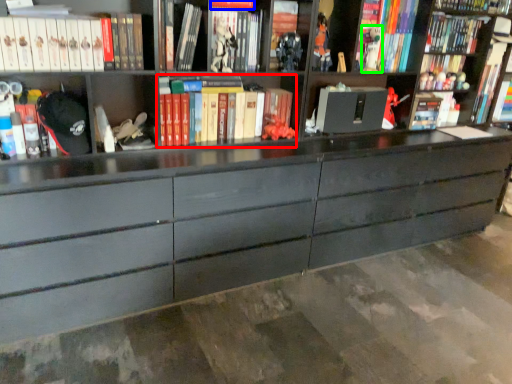
Question: Which is nearer to the book (highlighted by a red box)? book (highlighted by a blue box) or toy (highlighted by a green box).

Choices:
 (A) book
 (B) toy

Answer: (A)